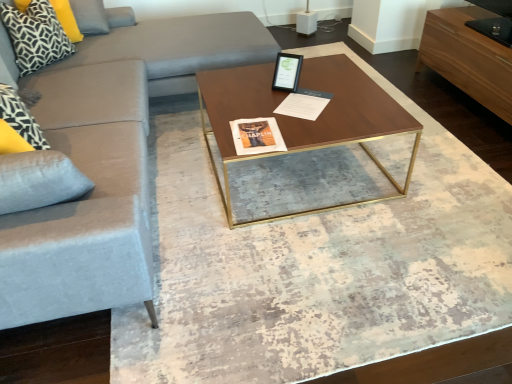
Locate an element on the screen. vacant area located to the right-hand side of walnut wood coffee table at center is located at coordinates (436, 174).